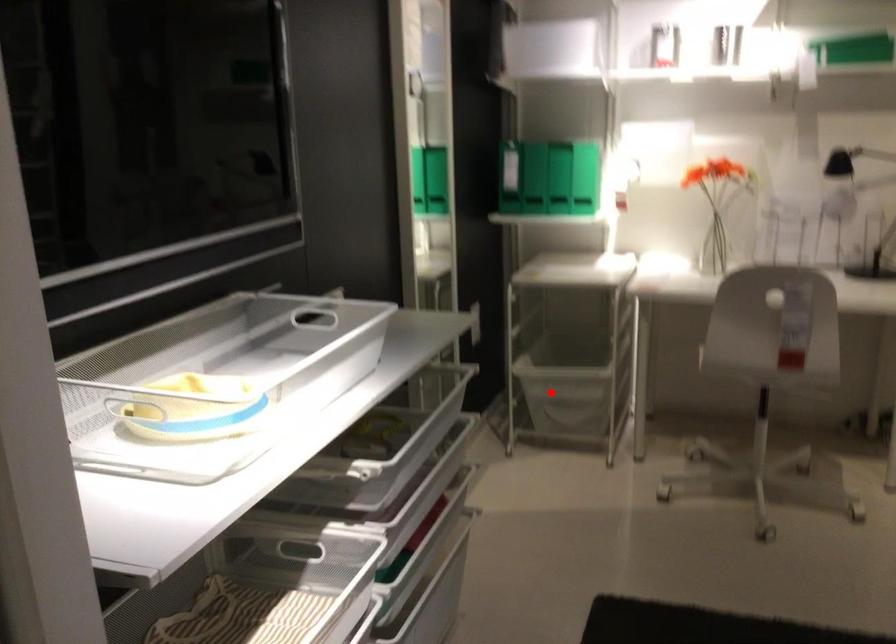
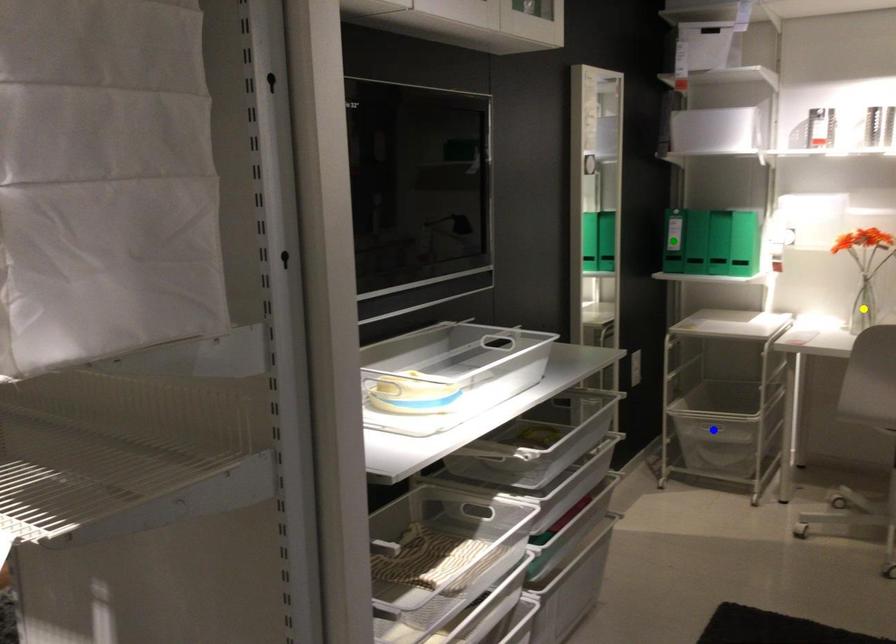
Question: I am providing you with two images of the same scene from different viewpoints. A red point is marked on the first image. You are given multiple points on the second image. Which point in image 2 represents the same 3d spot as the red point in image 1?

Choices:
 (A) yellow point
 (B) green point
 (C) blue point

Answer: (C)